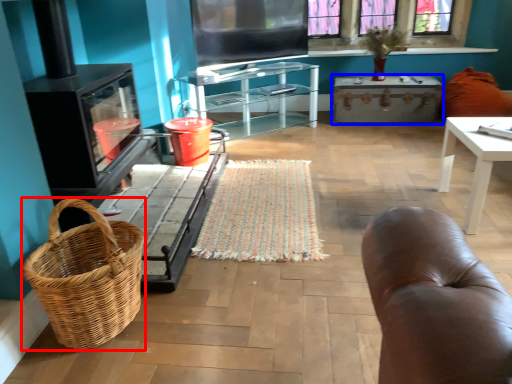
Question: Which object is further to the camera taking this photo, picnic basket (highlighted by a red box) or table (highlighted by a blue box)?

Choices:
 (A) picnic basket
 (B) table

Answer: (B)